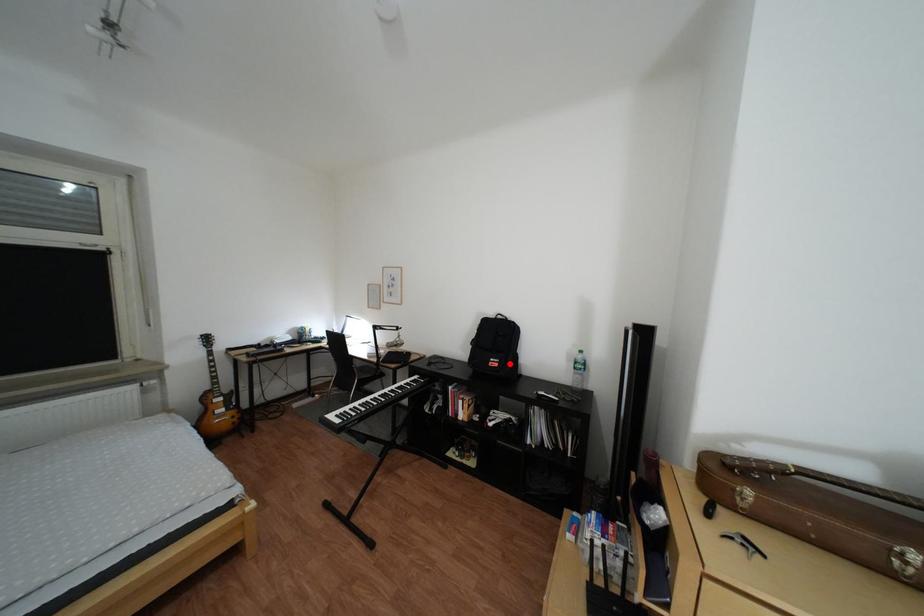
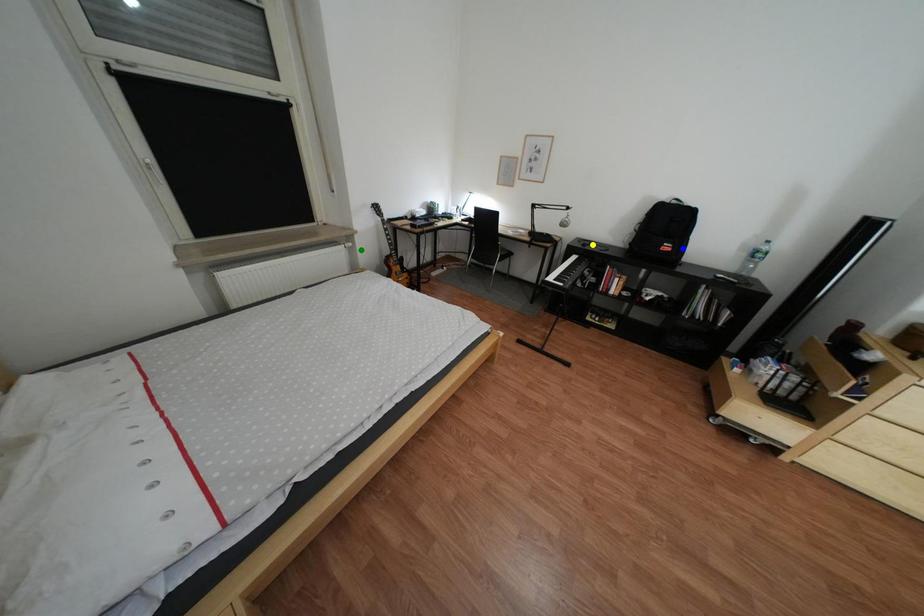
Question: I am providing you with two images of the same scene from different viewpoints. A red point is marked on the first image. You are given multiple points on the second image. Can you choose the point in image 2 that corresponds to the point in image 1?

Choices:
 (A) yellow point
 (B) green point
 (C) blue point

Answer: (C)